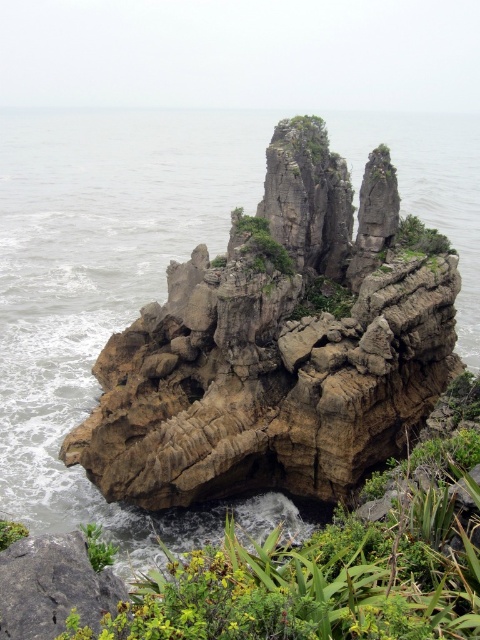
Question: Considering the real-world distances, which object is closest to the rough brown rock at lower left?

Choices:
 (A) green leafy plants at center
 (B) green leafy plant at lower left

Answer: (B)

Question: Is gray water at center to the right of green leafy plants at center from the viewer's perspective?

Choices:
 (A) no
 (B) yes

Answer: (A)

Question: Is rough brown rock at lower left positioned in front of green leafy shrub at upper right?

Choices:
 (A) yes
 (B) no

Answer: (A)

Question: Considering the real-world distances, which object is farthest from the gray water at center?

Choices:
 (A) green leafy plant at lower left
 (B) rough brown rock at lower left
 (C) green leafy shrub at upper right

Answer: (A)

Question: Does green leafy shrub at upper center have a lesser width compared to green leafy shrub at upper right?

Choices:
 (A) no
 (B) yes

Answer: (B)

Question: Which point is closer to the camera?

Choices:
 (A) rough brown rock at lower left
 (B) green leafy plant at lower left
 (C) green leafy shrub at upper right

Answer: (A)